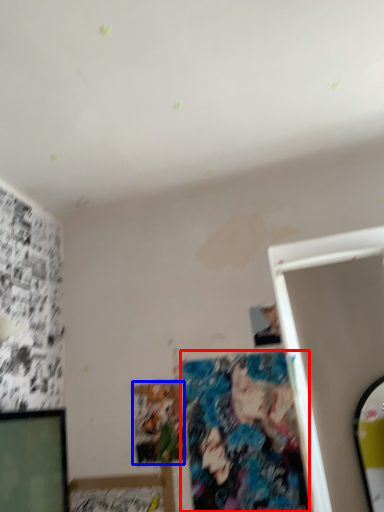
Question: Among these objects, which one is nearest to the camera, art (highlighted by a red box) or art (highlighted by a blue box)?

Choices:
 (A) art
 (B) art

Answer: (A)